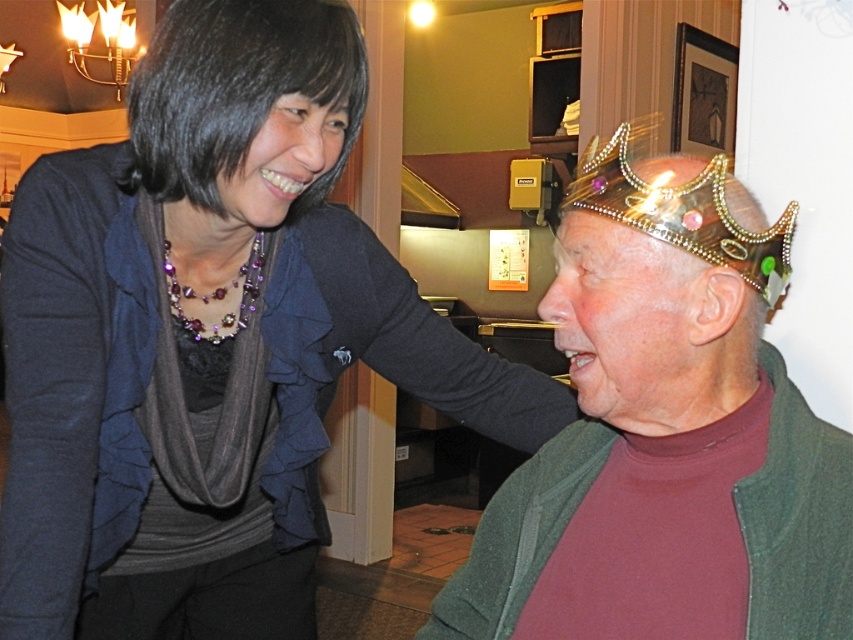
You are an interior designer planning to hang a decorative item between the matte black scarf at upper left and the shiny metallic crown at right. Based on their positions, which object should you place the item closer to if you want it to be centered between them?

The matte black scarf at upper left is to the left of the shiny metallic crown at right, so to center the decorative item between them, it should be placed closer to the shiny metallic crown at right since the distance between them would require the item to be positioned towards the right side to achieve balance.

You are a photographer setting up for a family photo. You need to ensure that the matte black scarf at upper left and the gold glittery tiara at upper center are both in focus. Given that your camera can only focus on objects within 20 inches of each other, will both items be in focus?

The matte black scarf at upper left is 22.41 inches away from the gold glittery tiara at upper center. Since the distance exceeds the camera focus range of 20 inches, both items cannot be in focus simultaneously.